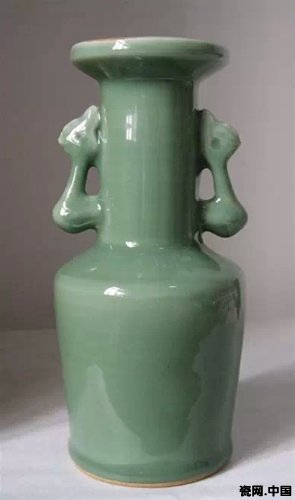
Locate an element on the screen. The height and width of the screenshot is (500, 295). body of vase is located at coordinates (143, 327).